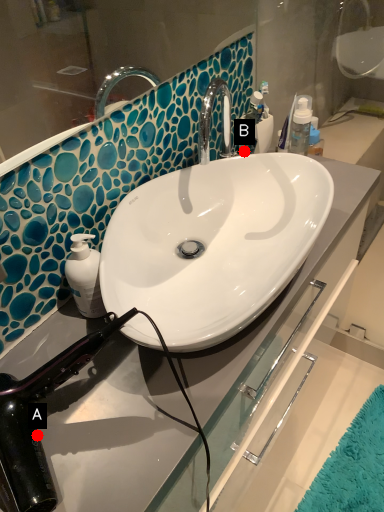
Question: Two points are circled on the image, labeled by A and B beside each circle. Which point is farther from the camera taking this photo?

Choices:
 (A) A is further
 (B) B is further

Answer: (B)